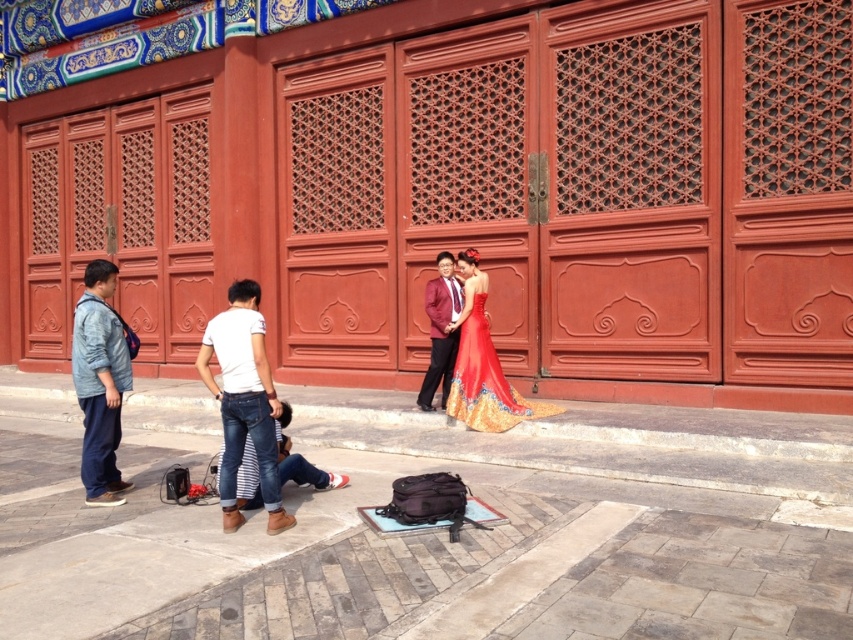
You are a photographer setting up a shoot in this traditional Chinese architectural setting. You have two outfits to choose from for the main character. The first is the denim pants at left, and the second is the shiny satin gown at center. Based on their visual properties, which outfit would be more suitable for blending into the historical ambiance of the scene?

The shiny satin gown at center would be more suitable for blending into the historical ambiance of the scene because it has a shinier texture compared to the denim pants at left, which might clash with the traditional elements.

You are a photographer positioned at the scene. You want to capture a photo that includes both the denim pants at left and the shiny satin gown at center. Given that your camera has a maximum focus range of 12 feet, will you be able to include both subjects in the same frame without moving?

The denim pants at left and shiny satin gown at center are 12.74 feet apart. Since the distance between them exceeds the camera maximum focus range of 12 feet, you cannot include both subjects in the same frame without moving.

You are standing in front of the traditional Chinese building and notice the denim pants at left. Based on their position coordinates, can you determine if they are closer to the building or the paved area?

The denim pants at left is located at point [99,381], which places them closer to the paved area rather than the building itself.